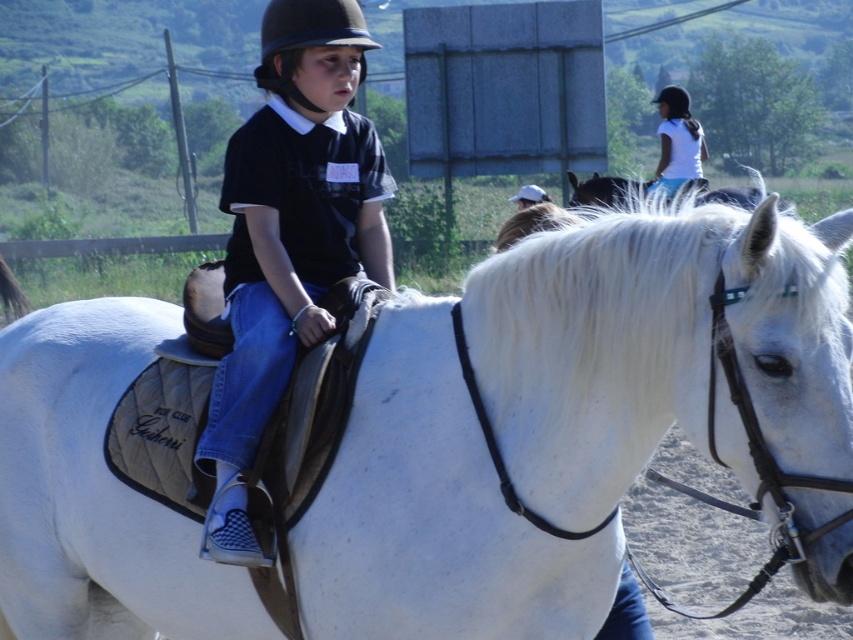
Does black matte shirt at center lie in front of black hard helmet at center?

Yes.

Does black matte shirt at center appear on the right side of black hard helmet at center?

Incorrect, black matte shirt at center is not on the right side of black hard helmet at center.

Is point (231, 515) positioned behind point (292, 35)?

No, it is not.

The width and height of the screenshot is (853, 640). In order to click on black matte shirt at center in this screenshot , I will do `click(289, 237)`.

Is white matte/suede saddle at center positioned behind black matte helmet at upper center?

No, it is in front of black matte helmet at upper center.

Does white matte/suede saddle at center appear on the right side of black matte helmet at upper center?

No, white matte/suede saddle at center is not to the right of black matte helmet at upper center.

Does point (485, 621) come in front of point (680, 88)?

That is True.

Identify the location of white matte/suede saddle at center. (567, 416).

Which is more to the right, black hard helmet at center or black matte helmet at upper center?

black matte helmet at upper center is more to the right.

Which is behind, point (355, 26) or point (672, 86)?

The point (672, 86) is more distant.

You are a GUI agent. You are given a task and a screenshot of the screen. Output one action in this format:
    pyautogui.click(x=<x>, y=<y>)
    Task: Click on the black hard helmet at center
    This screenshot has height=640, width=853.
    Given the screenshot: What is the action you would take?
    pyautogui.click(x=306, y=38)